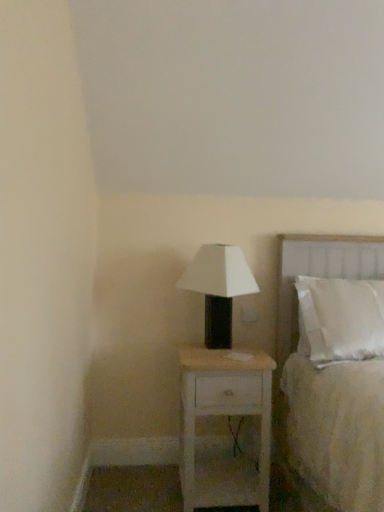
The width and height of the screenshot is (384, 512). In order to click on white wood nightstand at center in this screenshot , I will do `click(224, 416)`.

Where is `white matte table lamp at center`? Image resolution: width=384 pixels, height=512 pixels. white matte table lamp at center is located at coordinates (218, 288).

I want to click on white fabric bed at right, so click(x=320, y=378).

From the picture: Are white wood nightstand at center and white fabric bed at right making contact?

No, white wood nightstand at center is not beside white fabric bed at right.

Is the depth of white wood nightstand at center greater than that of white fabric bed at right?

Yes, the depth of white wood nightstand at center is greater than that of white fabric bed at right.

Is white fabric bed at right inside the boundaries of white matte table lamp at center, or outside?

white fabric bed at right is outside white matte table lamp at center.

Is white fabric bed at right beside white matte table lamp at center?

No, white fabric bed at right is not with white matte table lamp at center.

How distant is white fabric bed at right from white matte table lamp at center?

44.90 centimeters.

Which object is further away from the camera taking this photo, white fabric bed at right or white matte table lamp at center?

white matte table lamp at center is more distant.

Does white matte table lamp at center have a larger size compared to white wood nightstand at center?

Actually, white matte table lamp at center might be smaller than white wood nightstand at center.

Locate an element on the screen. The width and height of the screenshot is (384, 512). table lamp that is on the left side of white wood nightstand at center is located at coordinates (218, 288).

Is white matte table lamp at center directly adjacent to white wood nightstand at center?

white matte table lamp at center is not next to white wood nightstand at center, and they're not touching.

In terms of width, does white matte table lamp at center look wider or thinner when compared to white wood nightstand at center?

white matte table lamp at center is thinner than white wood nightstand at center.

Considering the relative positions of white wood nightstand at center and white matte table lamp at center in the image provided, is white wood nightstand at center to the left of white matte table lamp at center from the viewer's perspective?

No.

Considering the positions of point (228, 503) and point (209, 264), is point (228, 503) closer or farther from the camera than point (209, 264)?

Point (228, 503) appears to be closer to the viewer than point (209, 264).

From the image's perspective, is white wood nightstand at center positioned above or below white matte table lamp at center?

white wood nightstand at center is below white matte table lamp at center.

Can you confirm if white fabric bed at right is positioned to the left of white wood nightstand at center?

No, white fabric bed at right is not to the left of white wood nightstand at center.

From a real-world perspective, is white fabric bed at right positioned above or below white wood nightstand at center?

In terms of real-world spatial position, white fabric bed at right is above white wood nightstand at center.

Based on their sizes in the image, would you say white fabric bed at right is bigger or smaller than white wood nightstand at center?

Considering their sizes, white fabric bed at right takes up more space than white wood nightstand at center.

Is white matte table lamp at center in front of or behind white fabric bed at right in the image?

white matte table lamp at center is positioned farther from the viewer than white fabric bed at right.

Measure the distance from white matte table lamp at center to white fabric bed at right.

white matte table lamp at center and white fabric bed at right are 17.68 inches apart.

From a real-world perspective, is white matte table lamp at center physically above white fabric bed at right?

Correct, in the physical world, white matte table lamp at center is higher than white fabric bed at right.

In order to click on bed lying below the white matte table lamp at center (from the image's perspective) in this screenshot , I will do `click(320, 378)`.

Where is `bed above the white wood nightstand at center (from the image's perspective)`? This screenshot has height=512, width=384. bed above the white wood nightstand at center (from the image's perspective) is located at coordinates (320, 378).

Locate an element on the screen. The image size is (384, 512). table lamp above the white fabric bed at right (from a real-world perspective) is located at coordinates (218, 288).

Looking at the image, which one is located further to white matte table lamp at center, white wood nightstand at center or white fabric bed at right?

Among the two, white fabric bed at right is located further to white matte table lamp at center.

Based on their spatial positions, is white wood nightstand at center or white matte table lamp at center further from white fabric bed at right?

white matte table lamp at center lies further to white fabric bed at right than the other object.

When comparing their distances from white wood nightstand at center, does white matte table lamp at center or white fabric bed at right seem closer?

white fabric bed at right lies closer to white wood nightstand at center than the other object.

Looking at the image, which one is located further to white wood nightstand at center, white fabric bed at right or white matte table lamp at center?

The object further to white wood nightstand at center is white matte table lamp at center.

Which object lies nearer to the anchor point white matte table lamp at center, white fabric bed at right or white wood nightstand at center?

Among the two, white wood nightstand at center is located nearer to white matte table lamp at center.

Considering their positions, is white matte table lamp at center positioned further to white fabric bed at right than white wood nightstand at center?

white matte table lamp at center is further to white fabric bed at right.

Find the location of a particular element. Image resolution: width=384 pixels, height=512 pixels. nightstand between white matte table lamp at center and white fabric bed at right in the horizontal direction is located at coordinates (224, 416).